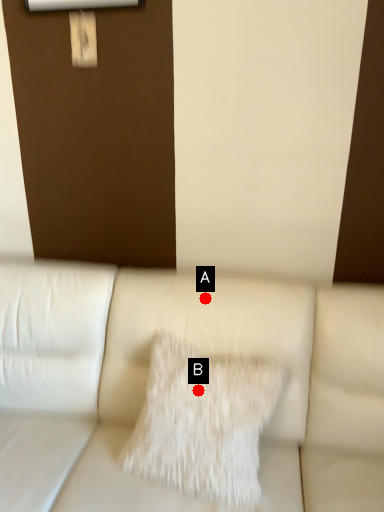
Question: Two points are circled on the image, labeled by A and B beside each circle. Which of the following is the closest to the observer?

Choices:
 (A) A is closer
 (B) B is closer

Answer: (B)